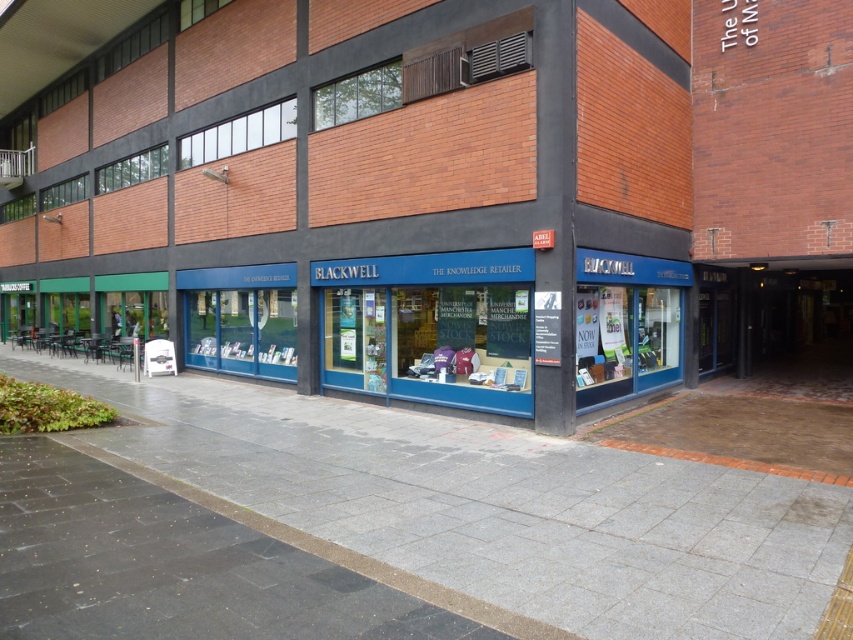
Is blue glass storefront at center taller than gray concrete pavement at center?

Yes.

Which of these two, blue glass storefront at center or gray concrete pavement at center, stands taller?

With more height is blue glass storefront at center.

Identify the location of blue glass storefront at center. The width and height of the screenshot is (853, 640). (370, 196).